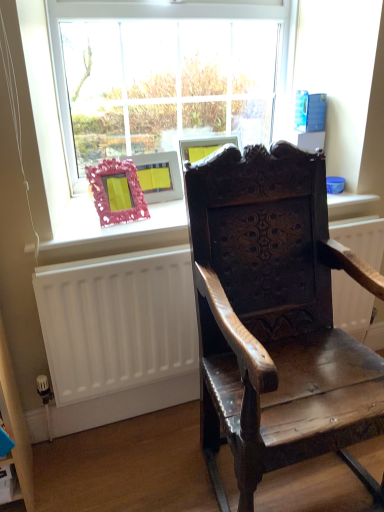
Question: From a real-world perspective, is clear glass window at upper center on top of white matte radiator at lower left?

Choices:
 (A) no
 (B) yes

Answer: (B)

Question: Is clear glass window at upper center far from white matte radiator at lower left?

Choices:
 (A) yes
 (B) no

Answer: (B)

Question: Does clear glass window at upper center have a greater width compared to white matte radiator at lower left?

Choices:
 (A) no
 (B) yes

Answer: (A)

Question: Does clear glass window at upper center appear on the right side of white matte radiator at lower left?

Choices:
 (A) no
 (B) yes

Answer: (A)

Question: From the image's perspective, is clear glass window at upper center on white matte radiator at lower left?

Choices:
 (A) yes
 (B) no

Answer: (A)

Question: Would you say white matte radiator at lower left is to the left or to the right of dark wood carved chair at center in the picture?

Choices:
 (A) left
 (B) right

Answer: (A)

Question: Looking at the image, does white matte radiator at lower left seem bigger or smaller compared to dark wood carved chair at center?

Choices:
 (A) small
 (B) big

Answer: (A)

Question: From the image's perspective, is white matte radiator at lower left located above or below dark wood carved chair at center?

Choices:
 (A) above
 (B) below

Answer: (B)

Question: In terms of height, does white matte radiator at lower left look taller or shorter compared to dark wood carved chair at center?

Choices:
 (A) tall
 (B) short

Answer: (B)

Question: In the image, is wooden frame at upper center positioned in front of or behind white matte radiator at lower left?

Choices:
 (A) behind
 (B) front

Answer: (A)

Question: In terms of width, does wooden frame at upper center look wider or thinner when compared to white matte radiator at lower left?

Choices:
 (A) wide
 (B) thin

Answer: (A)

Question: From the image's perspective, relative to white matte radiator at lower left, is wooden frame at upper center above or below?

Choices:
 (A) below
 (B) above

Answer: (B)

Question: Is point (114, 239) closer or farther from the camera than point (130, 361)?

Choices:
 (A) closer
 (B) farther

Answer: (A)

Question: From the image's perspective, relative to pink textured frame at window, is clear glass window at upper center above or below?

Choices:
 (A) below
 (B) above

Answer: (B)

Question: Is clear glass window at upper center inside or outside of pink textured frame at window?

Choices:
 (A) inside
 (B) outside

Answer: (B)